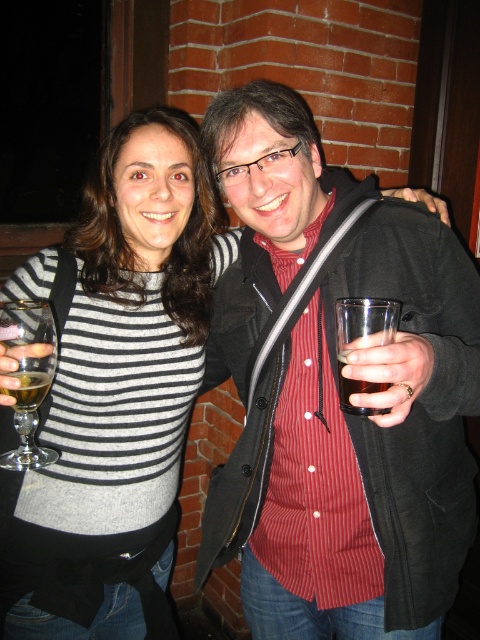
Question: Can you confirm if matte black jacket at center is thinner than striped knit sweater at center?

Choices:
 (A) yes
 (B) no

Answer: (B)

Question: Which of the following is the closest to the observer?

Choices:
 (A) (48, 308)
 (B) (189, 282)
 (C) (384, 620)
 (D) (288, 588)

Answer: (A)

Question: Does striped knit sweater at center appear over translucent glass at left?

Choices:
 (A) yes
 (B) no

Answer: (B)

Question: Is matte black jacket at center thinner than translucent glass at left?

Choices:
 (A) yes
 (B) no

Answer: (B)

Question: Which point appears farthest from the camera in this image?

Choices:
 (A) (335, 563)
 (B) (51, 580)

Answer: (A)

Question: Which object is positioned farthest from the red striped shirt at center?

Choices:
 (A) translucent glass at left
 (B) translucent glass at right

Answer: (A)